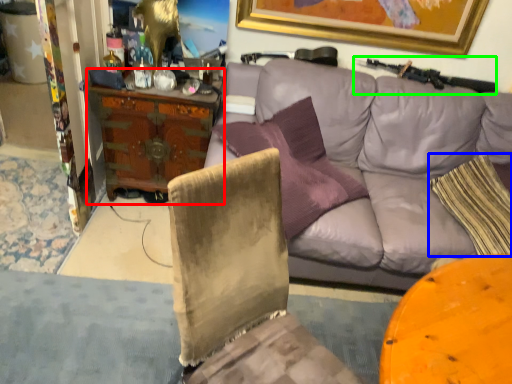
Question: Which object is positioned closest to desk (highlighted by a red box)? Select from pillow (highlighted by a blue box) and shotgun (highlighted by a green box).

Choices:
 (A) pillow
 (B) shotgun

Answer: (B)